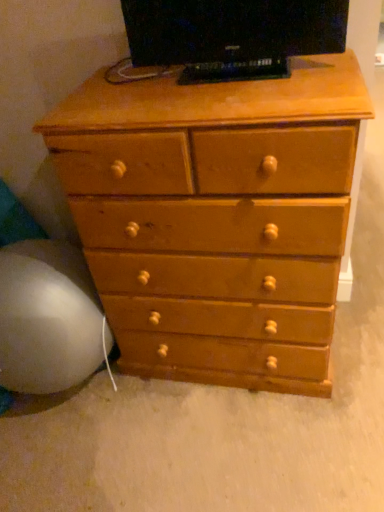
Question: Does light brown wood chest of drawers at center have a lesser height compared to white fabric bean bag at lower left?

Choices:
 (A) no
 (B) yes

Answer: (A)

Question: Can you confirm if light brown wood chest of drawers at center is smaller than white fabric bean bag at lower left?

Choices:
 (A) yes
 (B) no

Answer: (B)

Question: Does light brown wood chest of drawers at center turn towards white fabric bean bag at lower left?

Choices:
 (A) no
 (B) yes

Answer: (A)

Question: Are light brown wood chest of drawers at center and white fabric bean bag at lower left far apart?

Choices:
 (A) yes
 (B) no

Answer: (B)

Question: Are light brown wood chest of drawers at center and white fabric bean bag at lower left beside each other?

Choices:
 (A) no
 (B) yes

Answer: (A)

Question: Is light brown wood chest of drawers at center thinner than white fabric bean bag at lower left?

Choices:
 (A) no
 (B) yes

Answer: (B)

Question: From the image's perspective, would you say light brown wood chest of drawers at center is shown under matte black tv at upper center?

Choices:
 (A) no
 (B) yes

Answer: (B)

Question: Is light brown wood chest of drawers at center behind matte black tv at upper center?

Choices:
 (A) yes
 (B) no

Answer: (B)

Question: Does light brown wood chest of drawers at center have a greater width compared to matte black tv at upper center?

Choices:
 (A) no
 (B) yes

Answer: (B)

Question: Is light brown wood chest of drawers at center aimed at matte black tv at upper center?

Choices:
 (A) yes
 (B) no

Answer: (B)

Question: Is the position of light brown wood chest of drawers at center less distant than that of matte black tv at upper center?

Choices:
 (A) yes
 (B) no

Answer: (A)

Question: Are light brown wood chest of drawers at center and matte black tv at upper center far apart?

Choices:
 (A) no
 (B) yes

Answer: (A)

Question: Does matte black tv at upper center have a greater height compared to light brown wood chest of drawers at center?

Choices:
 (A) no
 (B) yes

Answer: (A)